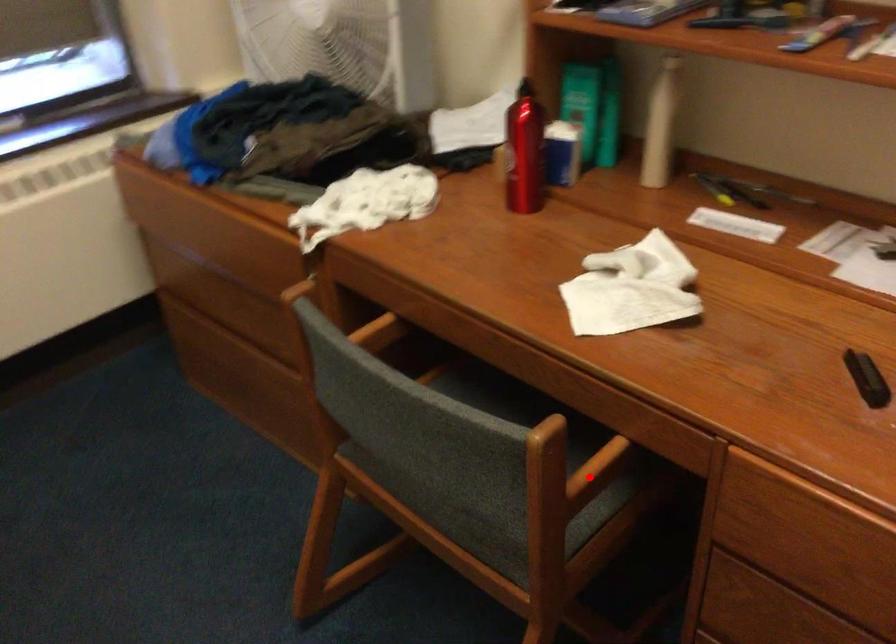
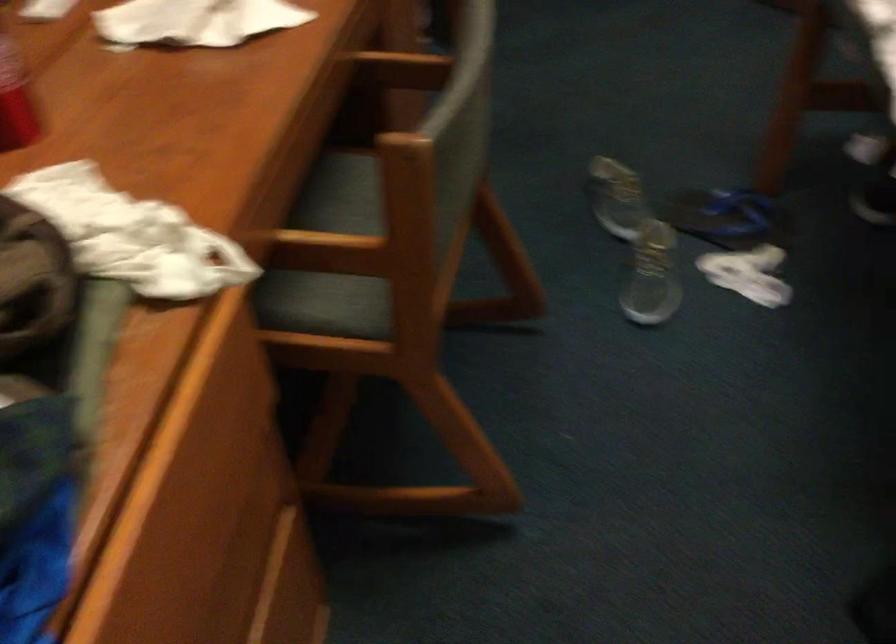
Question: I am providing you with two images of the same scene from different viewpoints. Image1 has a red point marked. In image2, the corresponding 3D location appears at what relative position? Reply with the corresponding letter.

Choices:
 (A) Closer
 (B) Farther

Answer: (B)